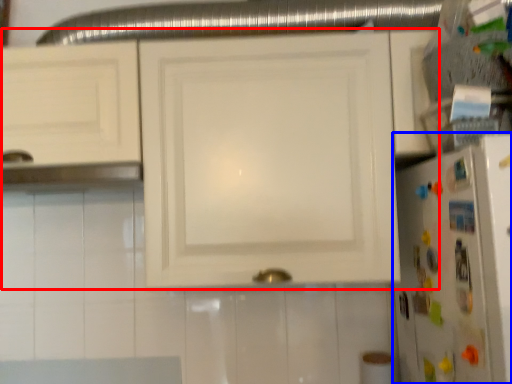
Question: Which of the following is the closest to the observer, cabinetry (highlighted by a red box) or refrigerator (highlighted by a blue box)?

Choices:
 (A) cabinetry
 (B) refrigerator

Answer: (B)